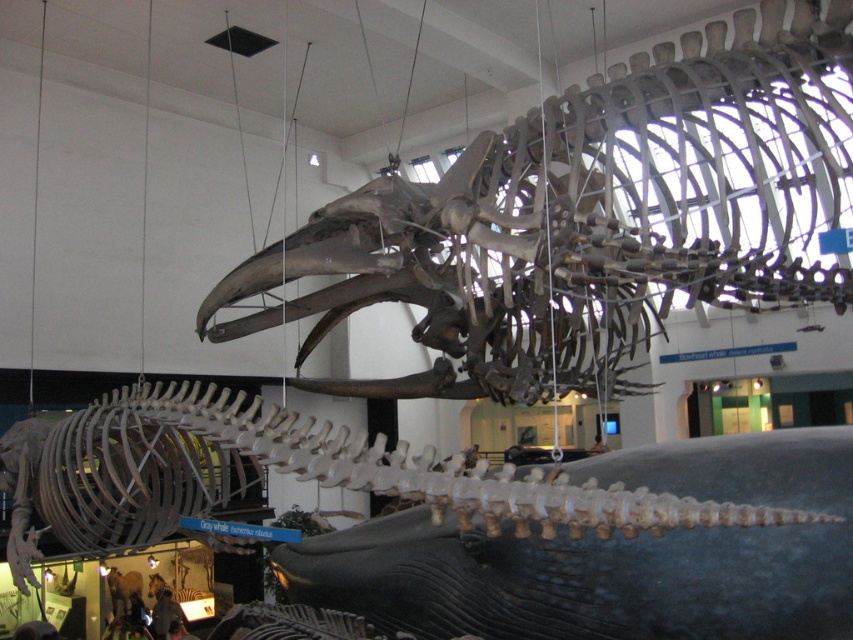
Question: Does bone-like skeleton at upper center appear on the left side of smooth gray whale at center?

Choices:
 (A) no
 (B) yes

Answer: (A)

Question: Among these points, which one is nearest to the camera?

Choices:
 (A) (403, 300)
 (B) (381, 564)

Answer: (B)

Question: Can you confirm if bone-like skeleton at upper center is positioned above smooth gray whale at center?

Choices:
 (A) no
 (B) yes

Answer: (B)

Question: Which of the following is the closest to the observer?

Choices:
 (A) (804, 67)
 (B) (509, 605)

Answer: (B)

Question: Is bone-like skeleton at upper center smaller than smooth gray whale at center?

Choices:
 (A) no
 (B) yes

Answer: (A)